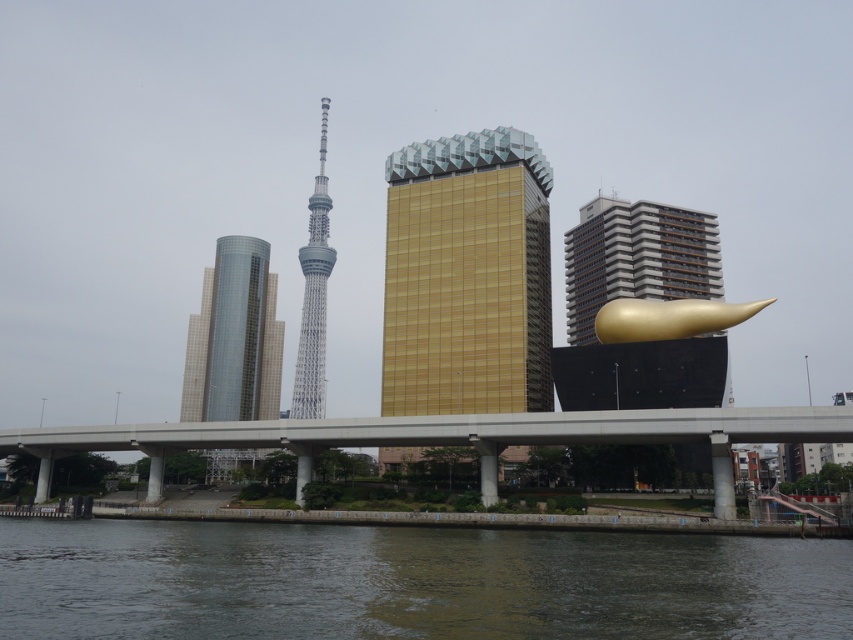
Question: Does glossy glass tower at center-left lie behind gold metallic sculpture at right?

Choices:
 (A) yes
 (B) no

Answer: (A)

Question: Among these objects, which one is farthest from the camera?

Choices:
 (A) glossy glass tower at center-left
 (B) gold textured building at center
 (C) dark gray water at lower center
 (D) gold metallic sculpture at right

Answer: (A)

Question: Does dark gray water at lower center appear on the left side of gold polished sculpture at right?

Choices:
 (A) yes
 (B) no

Answer: (A)

Question: Considering the real-world distances, which object is closest to the gold polished sculpture at right?

Choices:
 (A) gold textured building at center
 (B) gold metallic sculpture at right
 (C) concrete bridge at center

Answer: (B)

Question: Which is nearer to the dark gray water at lower center?

Choices:
 (A) glossy glass tower at center-left
 (B) gold polished sculpture at right
 (C) gold metallic sculpture at right

Answer: (B)

Question: Considering the relative positions of dark gray water at lower center and glossy glass tower at center-left in the image provided, where is dark gray water at lower center located with respect to glossy glass tower at center-left?

Choices:
 (A) below
 (B) above

Answer: (B)